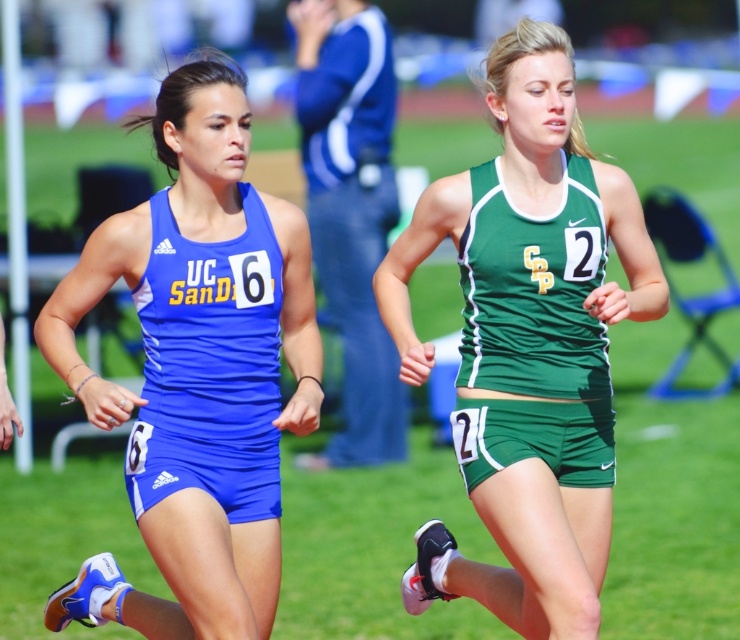
Question: Which point is farther from the camera taking this photo?

Choices:
 (A) (568, 438)
 (B) (462, 582)

Answer: (B)

Question: Is matte blue uniform at left below matte blue tank top at center?

Choices:
 (A) yes
 (B) no

Answer: (B)

Question: Does matte blue uniform at left have a greater width compared to green fabric tank top at center?

Choices:
 (A) no
 (B) yes

Answer: (B)

Question: Is green matte tank top at center thinner than green fabric tank top at center?

Choices:
 (A) no
 (B) yes

Answer: (A)

Question: Which object is closer to the camera taking this photo?

Choices:
 (A) matte blue tank top at center
 (B) green matte tank top at center
 (C) matte blue uniform at left

Answer: (C)

Question: Estimate the real-world distances between objects in this image. Which object is farther from the green fabric tank top at center?

Choices:
 (A) green matte tank top at center
 (B) matte blue uniform at left
 (C) matte blue tank top at center

Answer: (C)